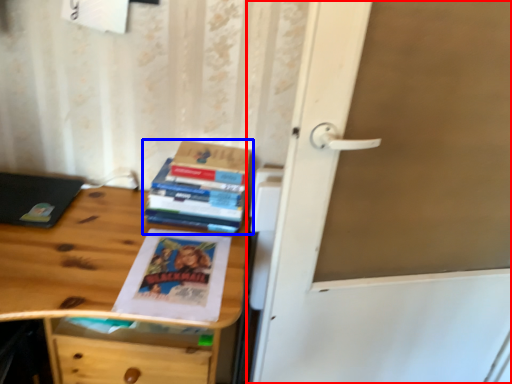
Question: Among these objects, which one is nearest to the camera, door (highlighted by a red box) or book (highlighted by a blue box)?

Choices:
 (A) door
 (B) book

Answer: (A)